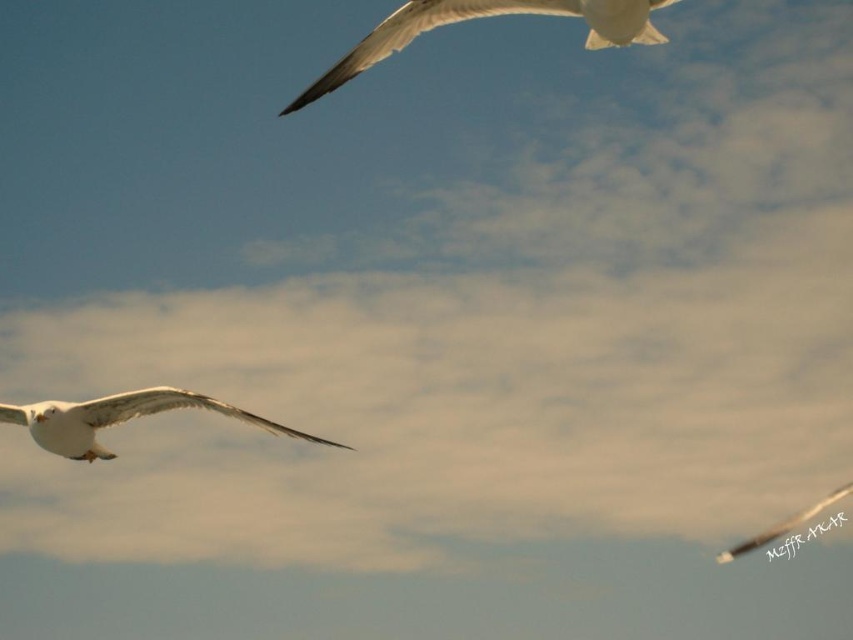
You are a photographer aiming to capture the white feathered bird at upper center in your shot. Based on its position coordinates, where should you focus your camera lens?

The white feathered bird at upper center is located at point [482,17], so you should focus your camera lens at those coordinates to capture it.